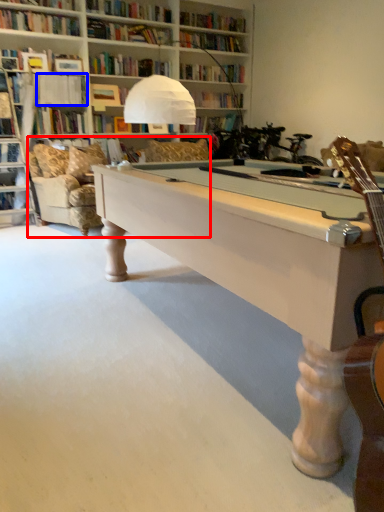
Question: Which object appears farthest to the camera in this image, couch (highlighted by a red box) or book (highlighted by a blue box)?

Choices:
 (A) couch
 (B) book

Answer: (B)